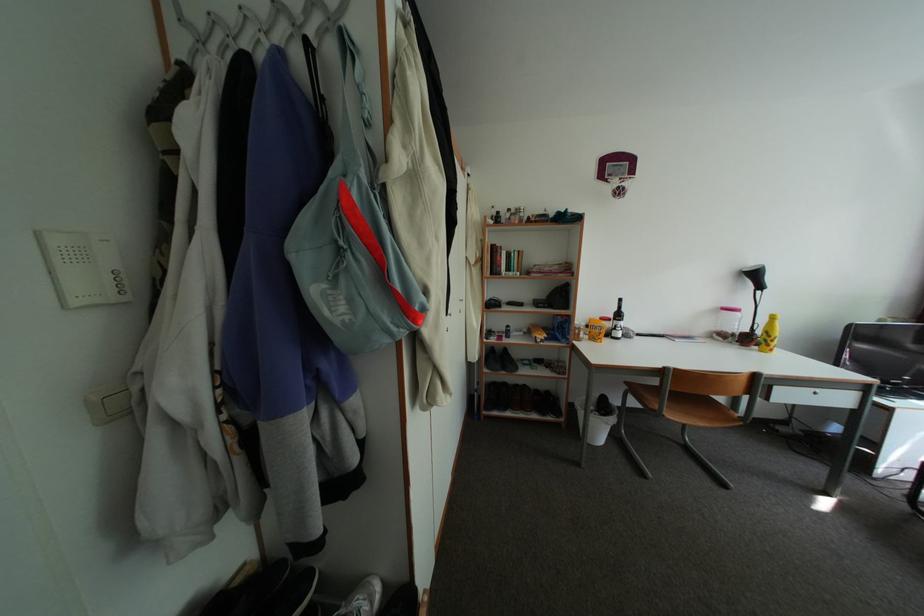
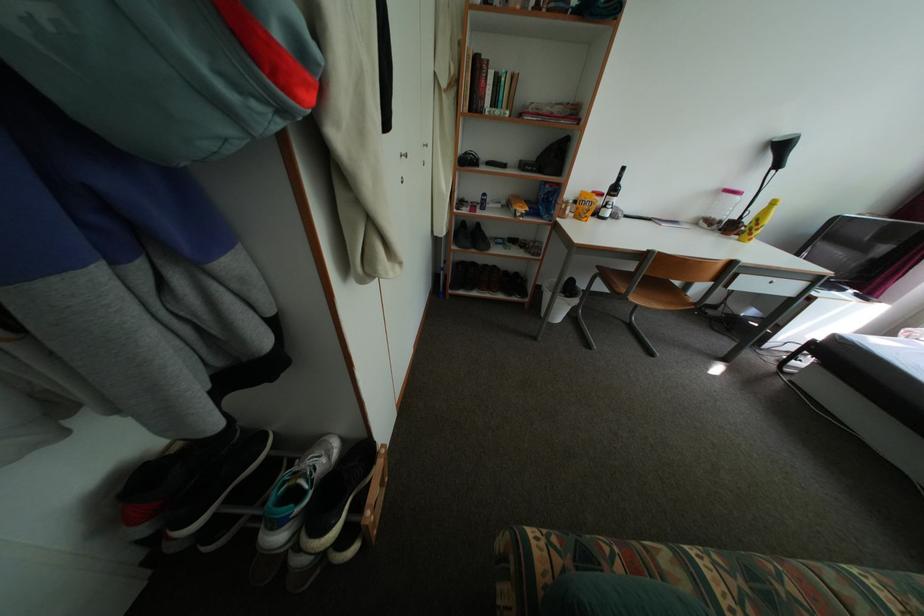
Question: Based on the continuous images, in which direction is the camera rotating? Reply with the corresponding letter.

Choices:
 (A) Left
 (B) Right
 (C) Up
 (D) Down

Answer: (D)